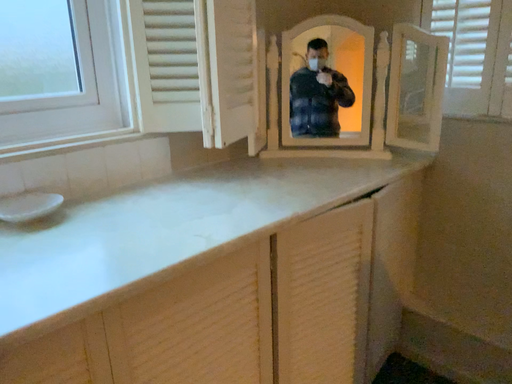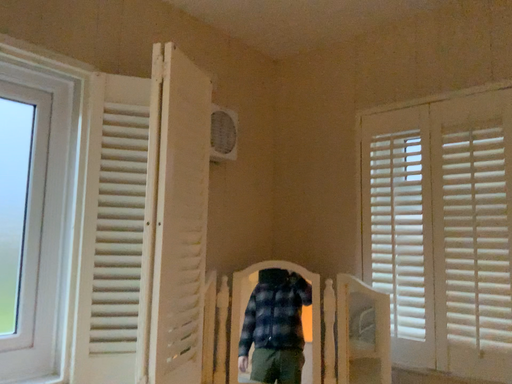
Question: How did the camera likely rotate when shooting the video?

Choices:
 (A) rotated upward
 (B) rotated downward

Answer: (A)